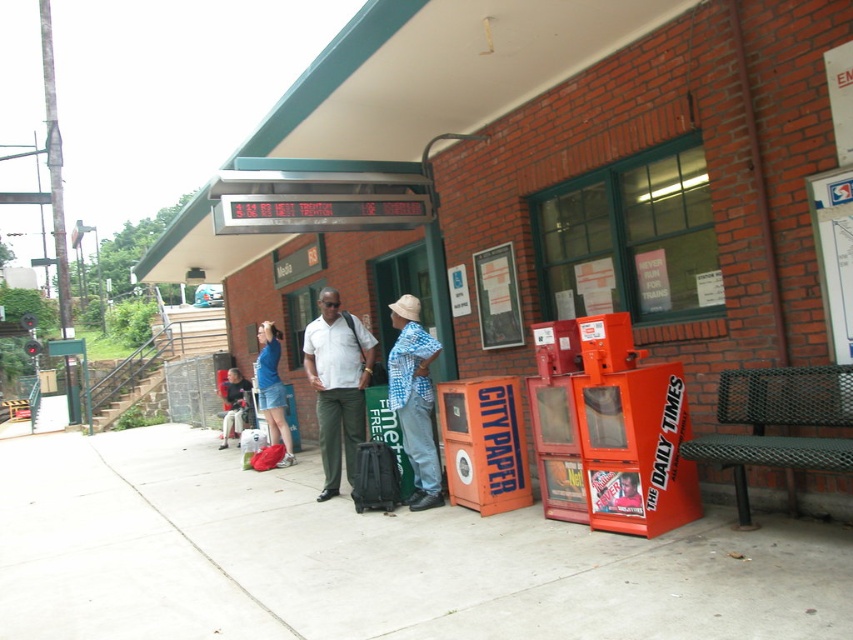
Is matte black shirt at center shorter than matte blue denim shorts at center?

Incorrect, matte black shirt at center's height does not fall short of matte blue denim shorts at center's.

Based on the photo, does matte black shirt at center have a smaller size compared to matte blue denim shorts at center?

Indeed, matte black shirt at center has a smaller size compared to matte blue denim shorts at center.

This screenshot has width=853, height=640. Identify the location of matte black shirt at center. (337, 385).

Image resolution: width=853 pixels, height=640 pixels. Identify the location of concrete at center. (366, 560).

Is point (396, 403) closer to viewer compared to point (260, 362)?

That is True.

Who is more distant from viewer, (422, 412) or (259, 340)?

Positioned behind is point (259, 340).

Locate an element on the screen. The height and width of the screenshot is (640, 853). checkered fabric shirt at center is located at coordinates tap(415, 400).